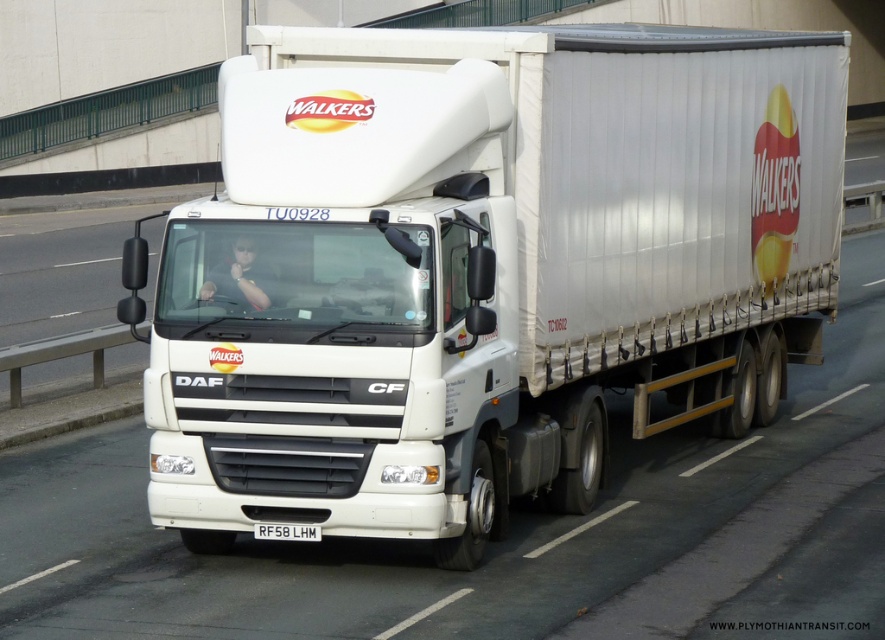
You are a pedestrian standing at the side of the road where the white matte truck at center and matte black shirt at center are located. You need to cross the road to the other side. Considering the distance between the truck and the shirt, is there enough space for you to safely cross without being hit by either?

The distance between the white matte truck at center and matte black shirt at center is 6.97 feet. Since this distance is narrow, it may not be safe to cross between them. It is advisable to wait for a safer gap or cross at a designated crossing area.

You are a delivery driver who needs to park the white matte truck at center and the matte black shirt at center in a garage with a height limit of 2 meters. According to the scene description, which object might not fit inside the garage?

The white matte truck at center is taller than the matte black shirt at center, so the white matte truck at center might not fit inside the garage with a 2 meters height limit.

You are a pedestrian standing on the sidewalk next to the concrete barrier. You see the white matte truck at center and the matte black shirt at center. Which object is closer to you?

The white matte truck at center is closer to you because it is in front of the matte black shirt at center.